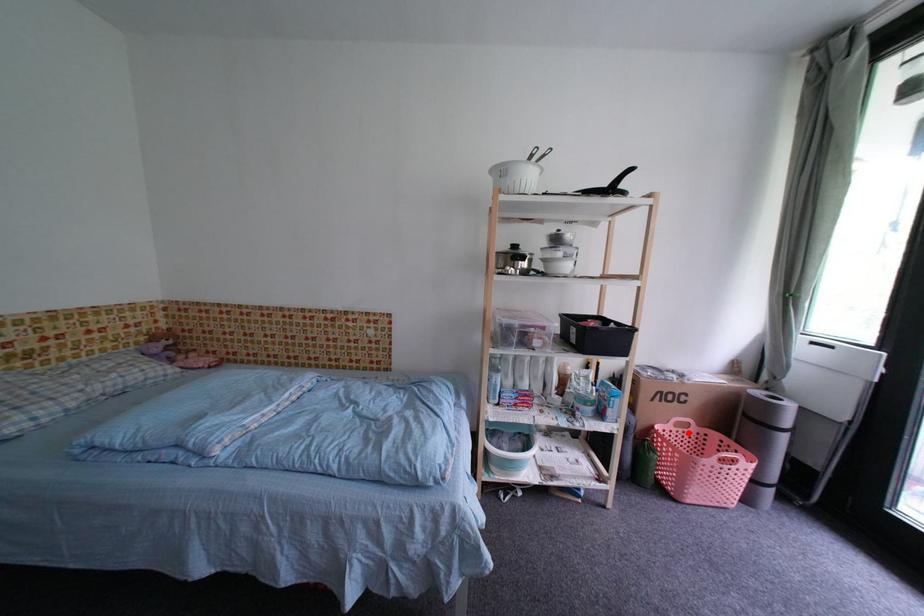
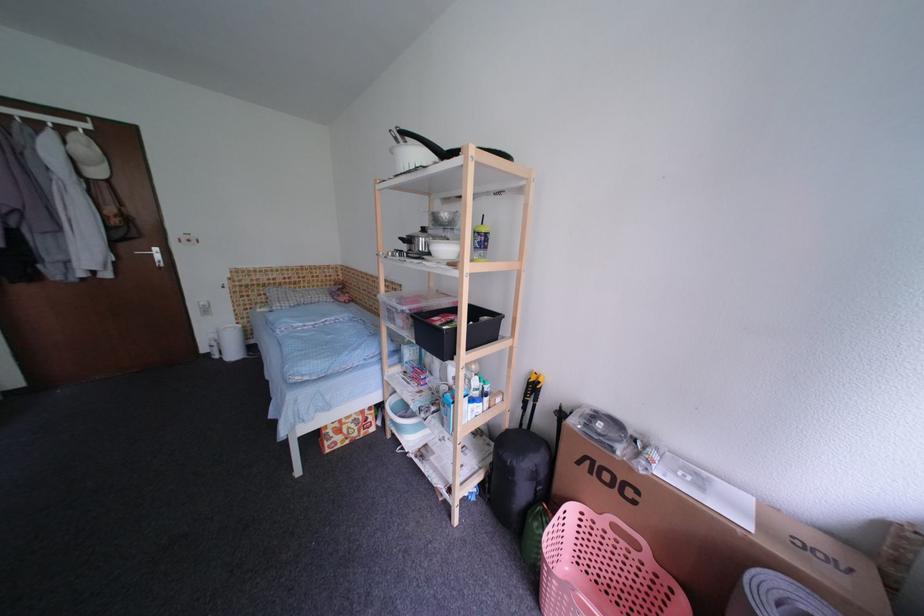
In the second image, find the point that corresponds to the highlighted location in the first image.

(630, 546)